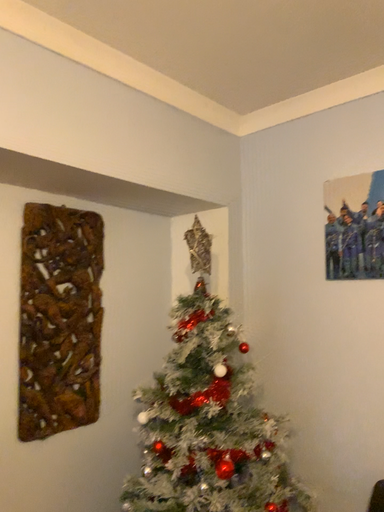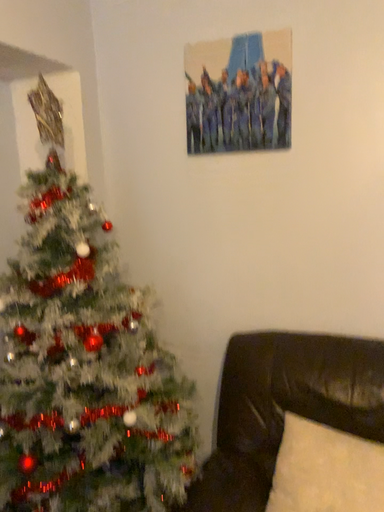
Question: How did the camera likely rotate when shooting the video?

Choices:
 (A) rotated downward
 (B) rotated upward

Answer: (A)